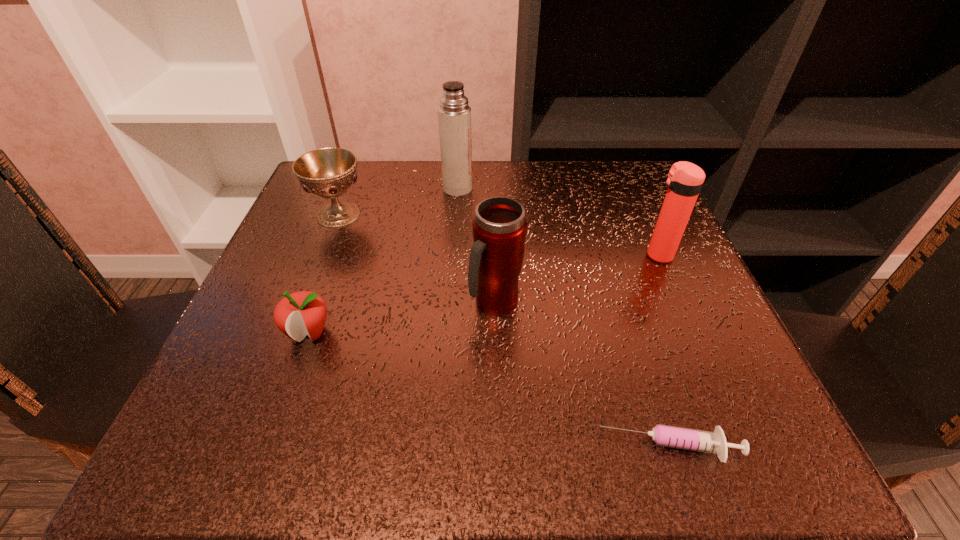
Find the location of a particular element. The image size is (960, 540). vacant space at the far right corner of the desktop is located at coordinates (615, 174).

Identify the location of vacant area that lies between the nearest thermos bottle and the syringe. The image size is (960, 540). (583, 376).

This screenshot has height=540, width=960. In order to click on free space between the tallest object and the chalice in this screenshot , I will do `click(398, 201)`.

At what (x,y) coordinates should I click in order to perform the action: click on free space that is in between the apple and the nearest thermos bottle. Please return your answer as a coordinate pair (x, y). This screenshot has width=960, height=540. Looking at the image, I should click on (402, 318).

At what (x,y) coordinates should I click in order to perform the action: click on vacant area between the chalice and the tallest object. Please return your answer as a coordinate pair (x, y). This screenshot has width=960, height=540. Looking at the image, I should click on pyautogui.click(x=398, y=201).

Locate an element on the screen. Image resolution: width=960 pixels, height=540 pixels. unoccupied position between the shortest object and the nearest thermos bottle is located at coordinates (583, 376).

At what (x,y) coordinates should I click in order to perform the action: click on free point between the third farthest object and the farthest thermos bottle. Please return your answer as a coordinate pair (x, y). The image size is (960, 540). Looking at the image, I should click on (558, 222).

Identify the location of the fourth closest object to the nearest thermos bottle. (327, 172).

Image resolution: width=960 pixels, height=540 pixels. I want to click on object that stands as the second closest to the chalice, so click(298, 314).

At what (x,y) coordinates should I click in order to perform the action: click on thermos bottle that is the second closest to the chalice. Please return your answer as a coordinate pair (x, y). Image resolution: width=960 pixels, height=540 pixels. Looking at the image, I should click on (499, 227).